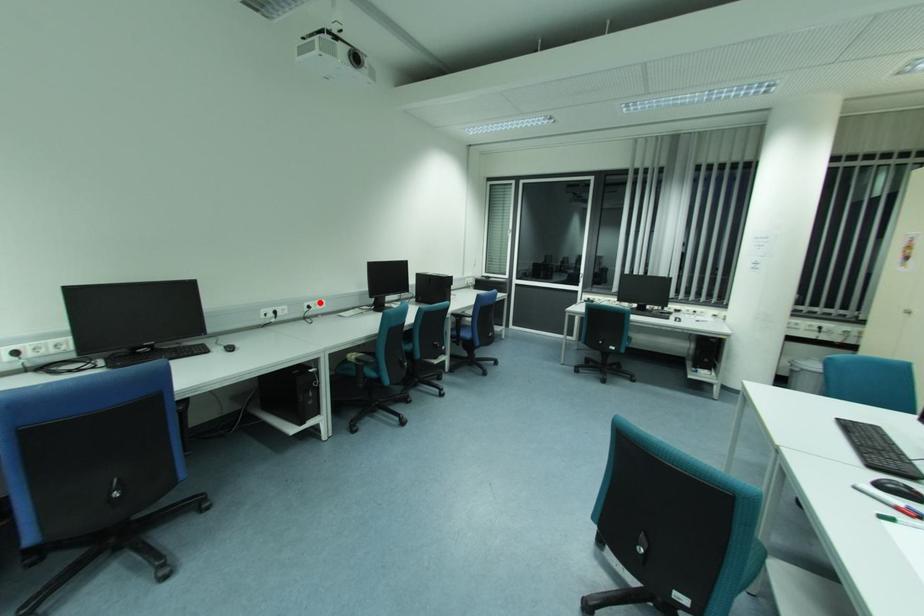
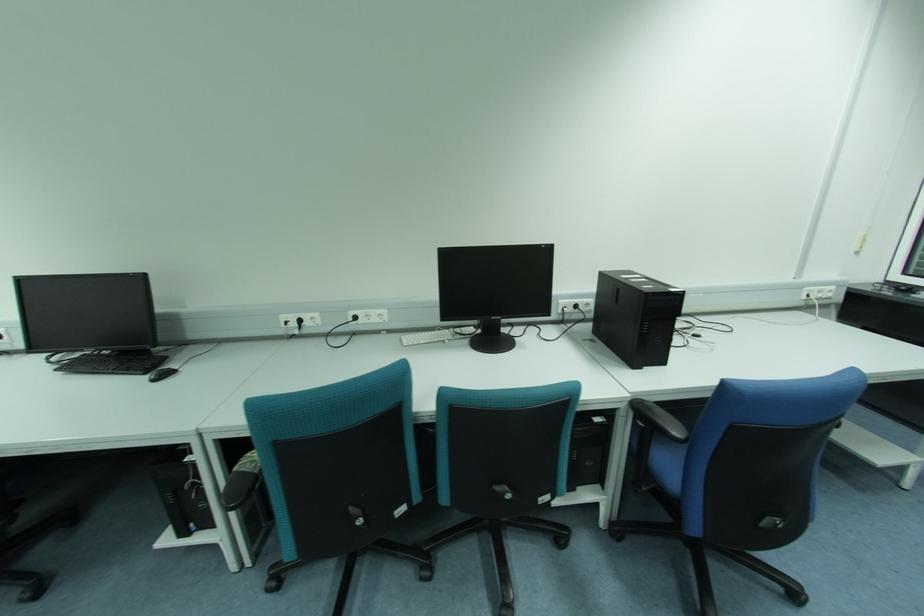
Where in the second image is the point corresponding to the highlighted location from the first image?

(374, 313)